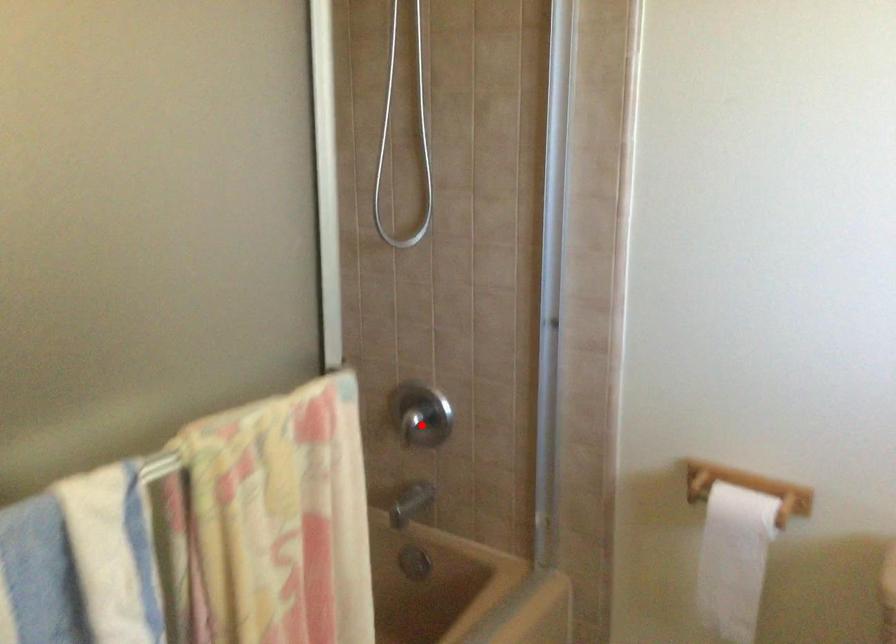
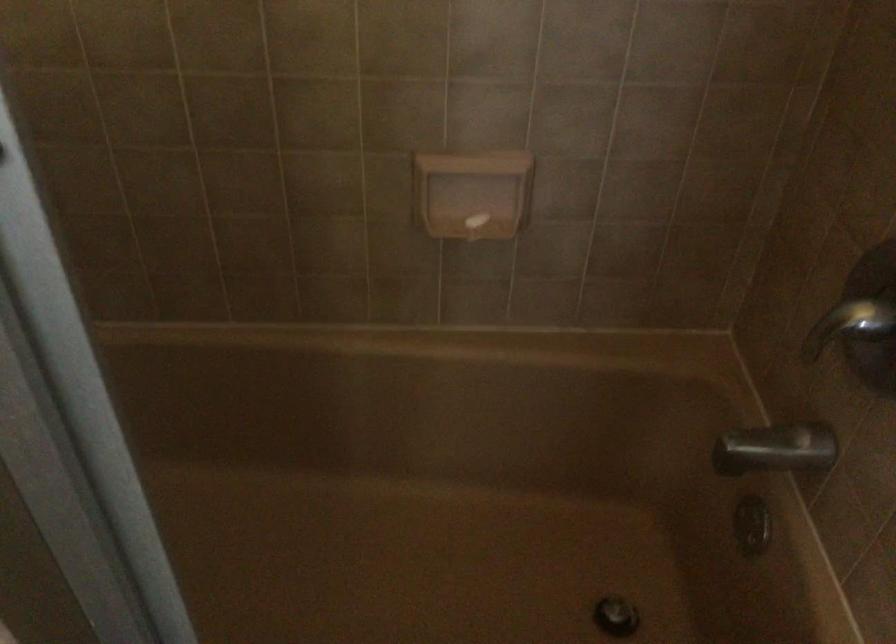
Question: I am providing you with two images of the same scene from different viewpoints. Image1 has a red point marked. In image2, the corresponding 3D location appears at what relative position? Reply with the corresponding letter.

Choices:
 (A) Closer
 (B) Farther

Answer: (A)